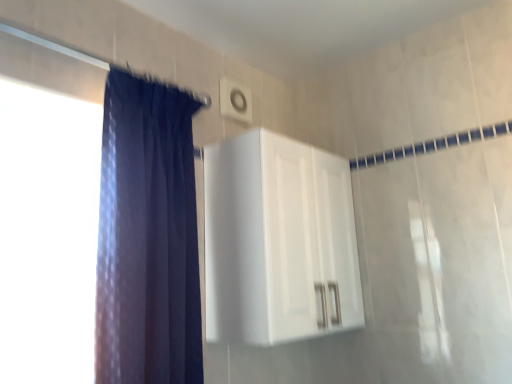
Question: Is white glossy cabinet at upper center inside the boundaries of dark blue fabric at left, or outside?

Choices:
 (A) inside
 (B) outside

Answer: (B)

Question: Would you say white glossy cabinet at upper center is to the left or to the right of dark blue fabric at left in the picture?

Choices:
 (A) right
 (B) left

Answer: (A)

Question: Which object is the closest to the white plastic light switch at upper center?

Choices:
 (A) white glossy cabinet at upper center
 (B) dark blue fabric at left

Answer: (A)

Question: Based on their relative distances, which object is nearer to the dark blue fabric at left?

Choices:
 (A) white plastic light switch at upper center
 (B) white glossy cabinet at upper center

Answer: (B)